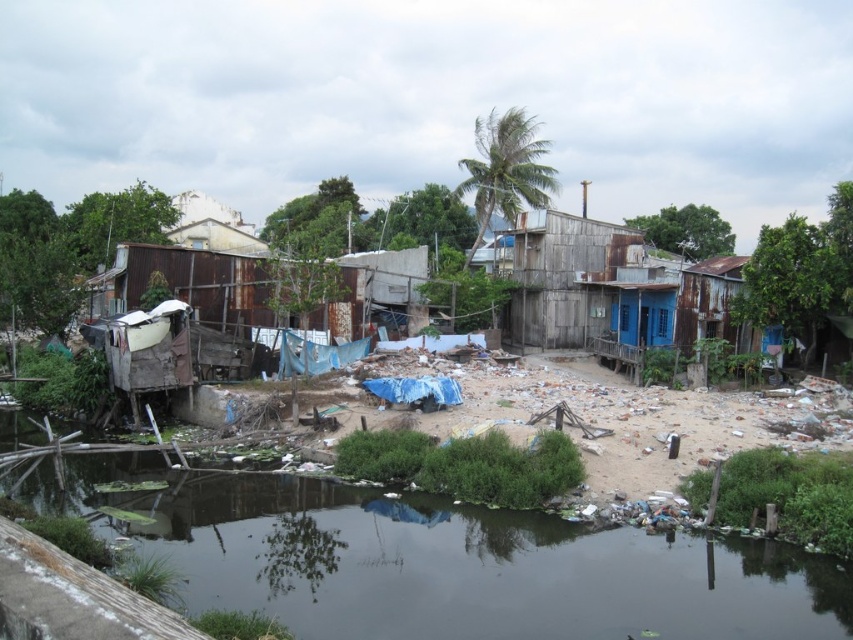
Question: Which of these objects is positioned closest to the rusty metal shack at right?

Choices:
 (A) dark green water at lower center
 (B) rusty wood shack at center
 (C) rusty metal shack at center-left

Answer: (B)

Question: Which point is closer to the camera?

Choices:
 (A) (207, 282)
 (B) (712, 276)
 (C) (47, 467)
 (D) (535, 301)

Answer: (C)

Question: Which object is positioned closest to the rusty wood shack at center?

Choices:
 (A) rusty metal shack at right
 (B) rusty metal shack at center-left

Answer: (A)

Question: Can you confirm if dark green water at lower center is positioned below rusty wood shack at center?

Choices:
 (A) no
 (B) yes

Answer: (B)

Question: Can you confirm if rusty metal shack at center-left is smaller than rusty metal shack at right?

Choices:
 (A) yes
 (B) no

Answer: (A)

Question: Is rusty wood shack at center to the left of rusty metal shack at right from the viewer's perspective?

Choices:
 (A) no
 (B) yes

Answer: (B)